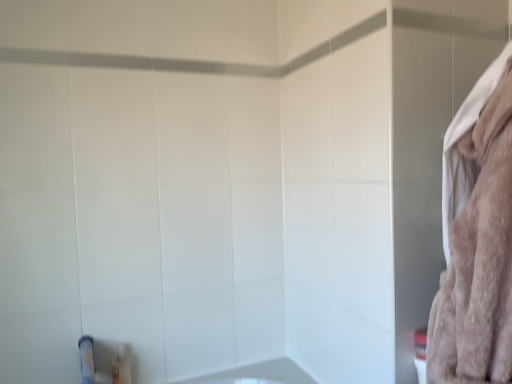
Question: Is fluffy pink towel at right behind translucent plastic tube at lower left?

Choices:
 (A) yes
 (B) no

Answer: (B)

Question: From a real-world perspective, is fluffy pink towel at right on translucent plastic tube at lower left?

Choices:
 (A) no
 (B) yes

Answer: (B)

Question: Is fluffy pink towel at right at the left side of translucent plastic tube at lower left?

Choices:
 (A) no
 (B) yes

Answer: (A)

Question: Is fluffy pink towel at right bigger than translucent plastic tube at lower left?

Choices:
 (A) yes
 (B) no

Answer: (A)

Question: Is fluffy pink towel at right oriented away from translucent plastic tube at lower left?

Choices:
 (A) no
 (B) yes

Answer: (A)

Question: Is translucent plastic tube at lower left a part of fluffy pink towel at right?

Choices:
 (A) no
 (B) yes

Answer: (A)

Question: Considering the relative sizes of translucent plastic tube at lower left and fluffy pink towel at right in the image provided, is translucent plastic tube at lower left bigger than fluffy pink towel at right?

Choices:
 (A) no
 (B) yes

Answer: (A)

Question: Does translucent plastic tube at lower left have a greater height compared to fluffy pink towel at right?

Choices:
 (A) no
 (B) yes

Answer: (A)

Question: From the image's perspective, is translucent plastic tube at lower left under fluffy pink towel at right?

Choices:
 (A) no
 (B) yes

Answer: (B)

Question: Is translucent plastic tube at lower left directly adjacent to fluffy pink towel at right?

Choices:
 (A) no
 (B) yes

Answer: (A)

Question: Is translucent plastic tube at lower left further to camera compared to fluffy pink towel at right?

Choices:
 (A) no
 (B) yes

Answer: (B)

Question: Is translucent plastic tube at lower left not near fluffy pink towel at right?

Choices:
 (A) yes
 (B) no

Answer: (A)

Question: Is point (121, 370) positioned closer to the camera than point (488, 144)?

Choices:
 (A) farther
 (B) closer

Answer: (A)